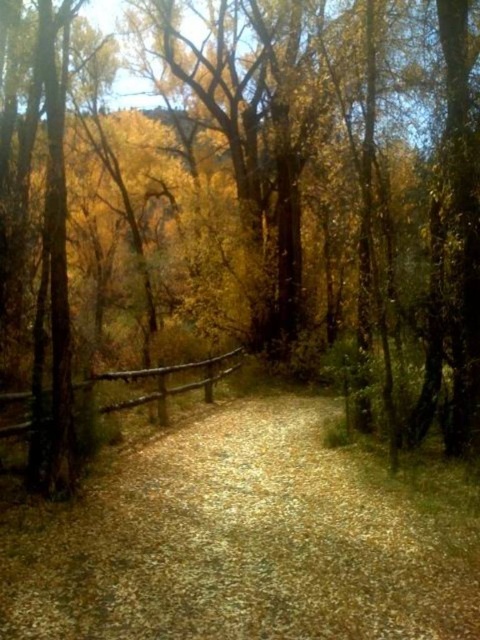
This screenshot has width=480, height=640. I want to click on gravelly dirt path at center, so click(x=239, y=545).